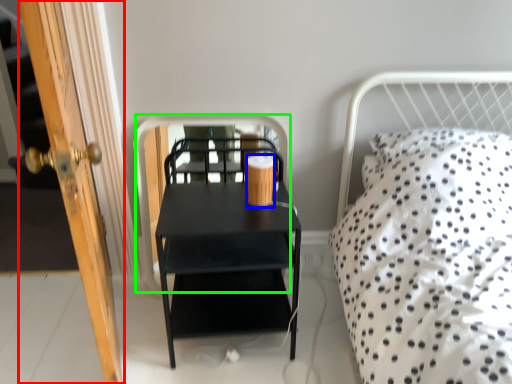
Question: Based on their relative distances, which object is nearer to door (highlighted by a red box)? Choose from coffee cup (highlighted by a blue box) and screen door (highlighted by a green box).

Choices:
 (A) coffee cup
 (B) screen door

Answer: (A)